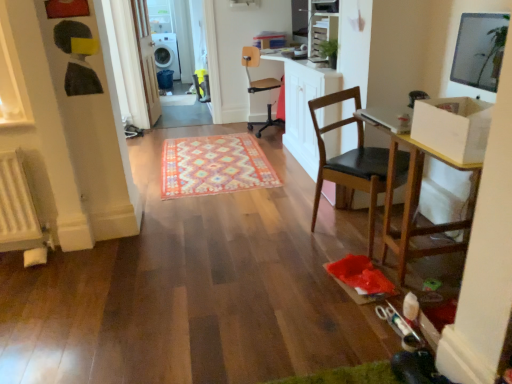
Identify the location of vacant space that is in between black leather chair at center, marked as the 1th chair in a front-to-back arrangement, and white matte radiator at lower left. (226, 240).